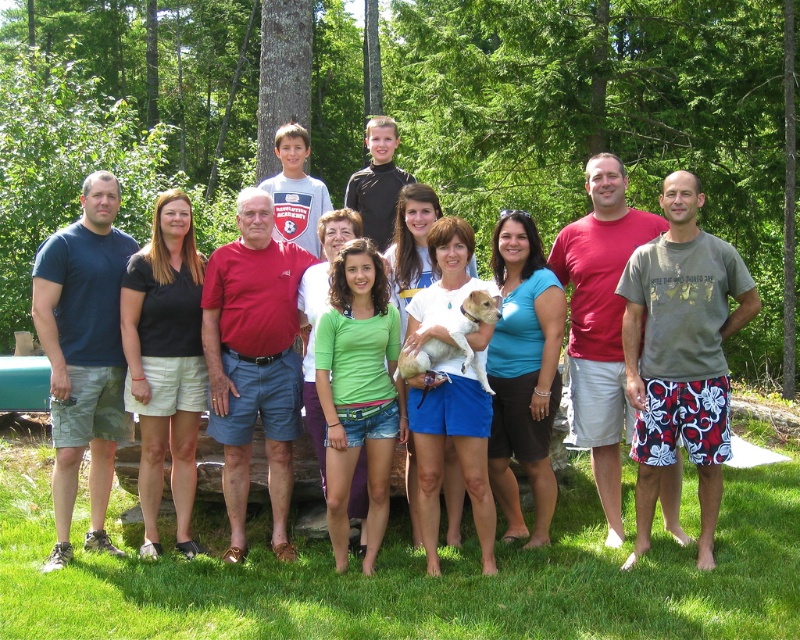
You are a photographer trying to capture a photo of the group while ensuring the green leafy tree at center and the white fur dog at center are both visible. Which object should you focus on first to ensure both are in frame?

The green leafy tree at center is taller than the white fur dog at center, so you should focus on the taller green leafy tree at center first to ensure both are in frame.

Based on the photo, you are a photographer taking a group photo. You notice the matte blue shirt at center and the white fur dog at center. Which one should you focus on if you want to ensure the larger subject is in sharp focus?

You should focus on the matte blue shirt at center because it is bigger than the white fur dog at center.

In the scene shown: You are a photographer trying to position the matte blue shirt at center and the white fur dog at center in the frame. Which object should you adjust to ensure both are fully visible in the photo?

Since the matte blue shirt at center is much taller than the white fur dog at center, you should lower the camera angle to capture the entire height of the matte blue shirt at center while keeping the white fur dog at center in view.